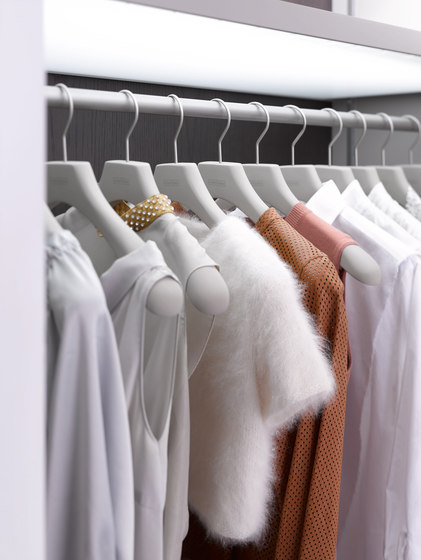
The height and width of the screenshot is (560, 421). Identify the location of clothes hanger hooks. (71, 113), (135, 118), (181, 122), (227, 126), (265, 129), (301, 132), (337, 134), (363, 135), (389, 137), (417, 139).